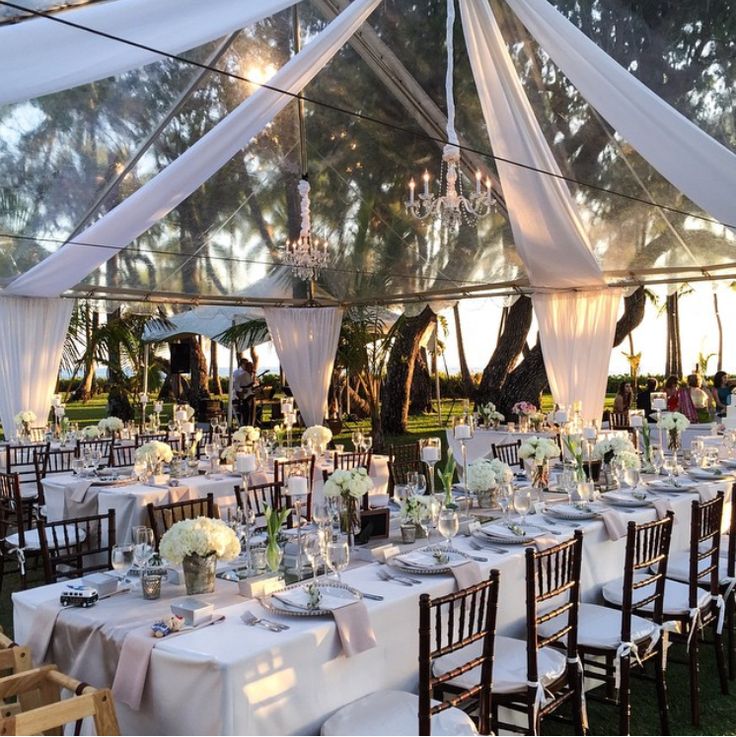
Locate an element on the screen. The image size is (736, 737). napkins is located at coordinates point(352,618), point(475,583), point(552,537), point(614,520), point(659,500), point(700,489), point(81,485), point(179,499), point(250,475).